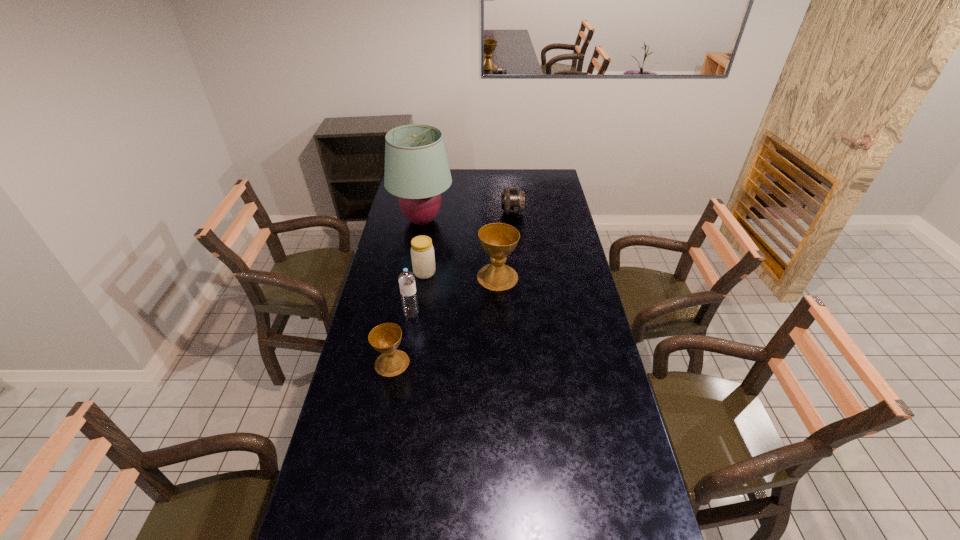
You are a GUI agent. You are given a task and a screenshot of the screen. Output one action in this format:
    pyautogui.click(x=<x>, y=<y>)
    Task: Click on the nearer chalice
    The image size is (960, 540).
    Given the screenshot: What is the action you would take?
    pyautogui.click(x=385, y=338)

Identify the location of the nearest object. tap(385, 338).

Find the location of a particular element. This screenshot has width=960, height=540. the farther chalice is located at coordinates (498, 240).

The image size is (960, 540). I want to click on the taller chalice, so click(498, 240).

The height and width of the screenshot is (540, 960). I want to click on telephoto lens, so click(512, 199).

Find the location of a particular element. The image size is (960, 540). lampshade is located at coordinates (417, 171).

Image resolution: width=960 pixels, height=540 pixels. Find the location of `the second nearest object`. the second nearest object is located at coordinates (406, 279).

Where is `jar`? The image size is (960, 540). jar is located at coordinates (422, 252).

In order to click on vacant space situated on the right of the nearest object in this screenshot , I will do click(x=467, y=363).

Locate an element on the screen. vacant space located 0.370m on the front of the taller chalice is located at coordinates (501, 363).